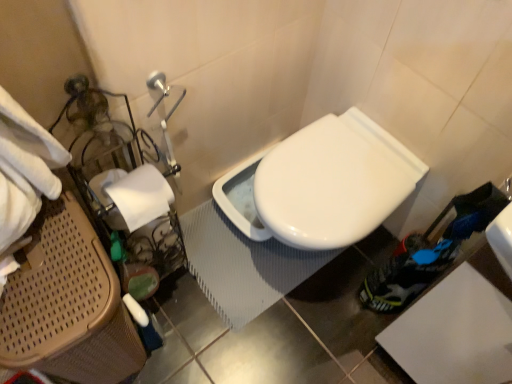
I want to click on free spot above brown woven laundry basket at left (from a real-world perspective), so click(52, 269).